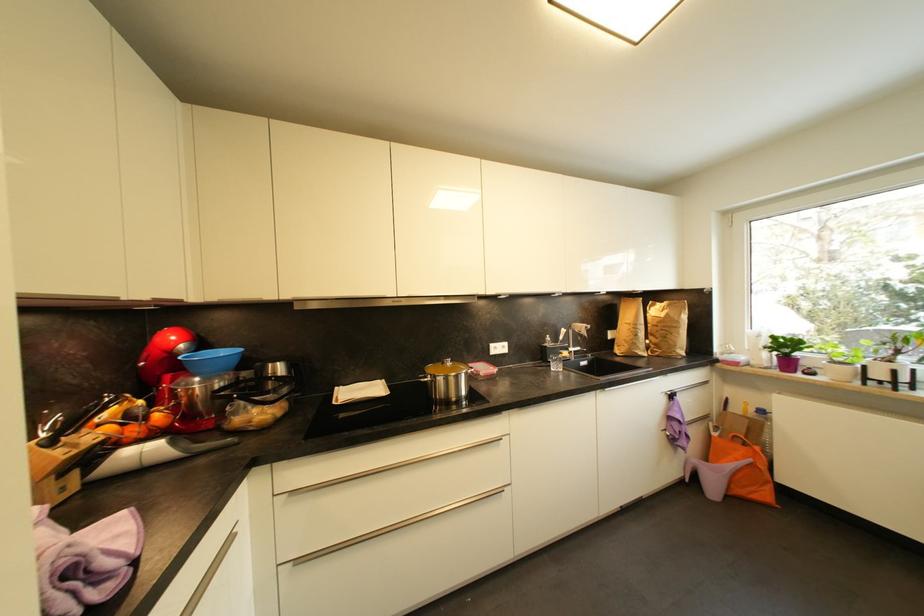
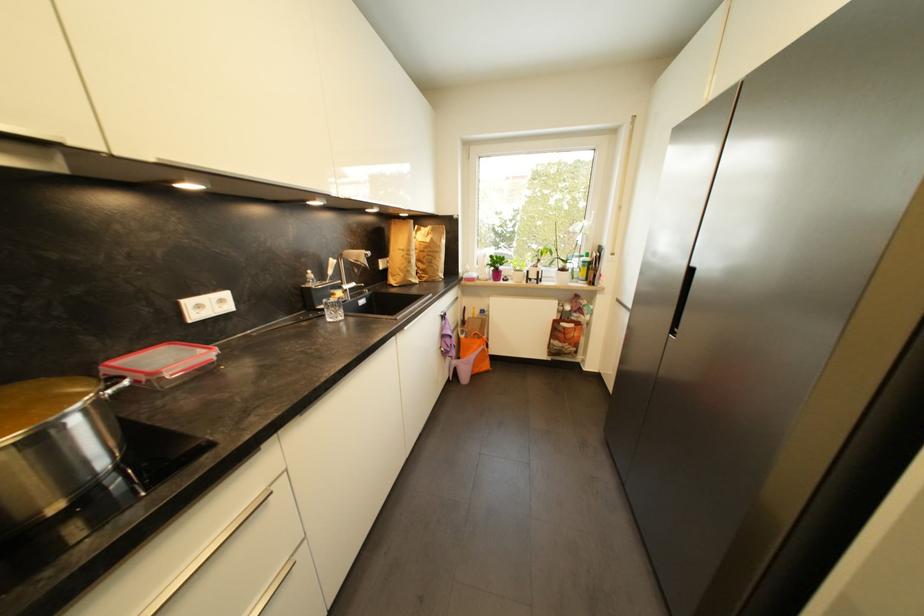
The point at (561, 369) is marked in the first image. Where is the corresponding point in the second image?

(339, 317)